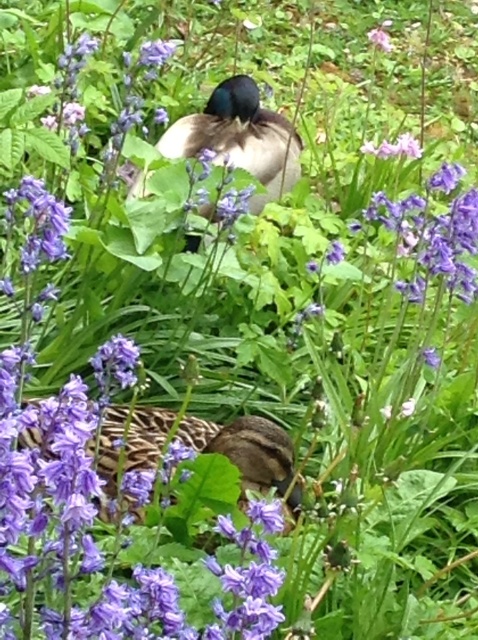
You are standing in the scene and want to reach the point marked as point [192,125]. Considering your height is 5 feet 8 inches, will you be able to see over the tall bluebells and foliage when you arrive there?

The point [192,125] is 8.53 feet from the viewer. Since the bluebells and foliage are in the foreground and middle ground, their height might obstruct your view. However, without specific height data on the vegetation, it is uncertain if you can see over them. The answer cannot be definitively determined with the given information.

You are a photographer standing at the camera position. You want to focus on the duck closest to you. Which point should you focus on, point (209,124) or point (390,45)?

Point (209,124) is closer to the camera than point (390,45), so you should focus on point (209,124) to capture the duck closest to you.

Consider the image. You are a photographer trying to capture a closeup of the shiny black duck at center and the pink matte flower at upper center. Which object is wider so that you can adjust your camera focus accordingly?

The shiny black duck at center is wider than the pink matte flower at upper center, so you should focus on the shiny black duck at center to capture its width properly.